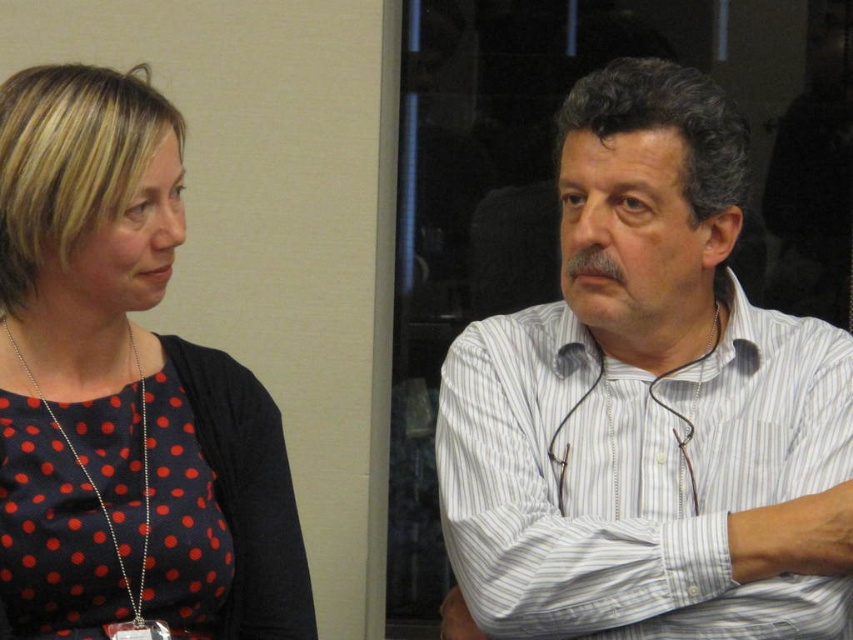
Question: Which object is farther from the camera taking this photo?

Choices:
 (A) polka dot fabric dress at left
 (B) white striped shirt at right

Answer: (B)

Question: Is white striped shirt at right below polka dot fabric dress at left?

Choices:
 (A) yes
 (B) no

Answer: (A)

Question: Does white striped shirt at right appear under polka dot fabric dress at left?

Choices:
 (A) no
 (B) yes

Answer: (B)

Question: Which object is closer to the camera taking this photo?

Choices:
 (A) polka dot fabric dress at left
 (B) white striped shirt at right

Answer: (A)

Question: Observing the image, what is the correct spatial positioning of white striped shirt at right in reference to polka dot fabric dress at left?

Choices:
 (A) above
 (B) below

Answer: (B)